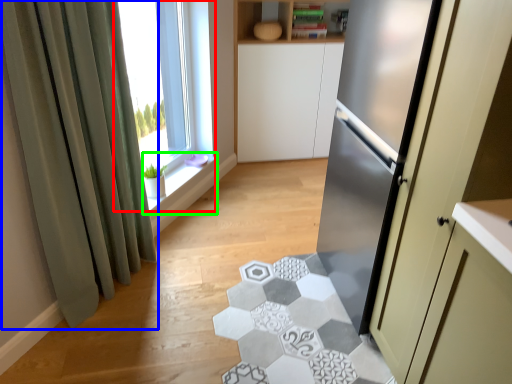
Question: Which object is the closest to the window (highlighted by a red box)? Choose among these: curtain (highlighted by a blue box) or window sill (highlighted by a green box).

Choices:
 (A) curtain
 (B) window sill

Answer: (B)